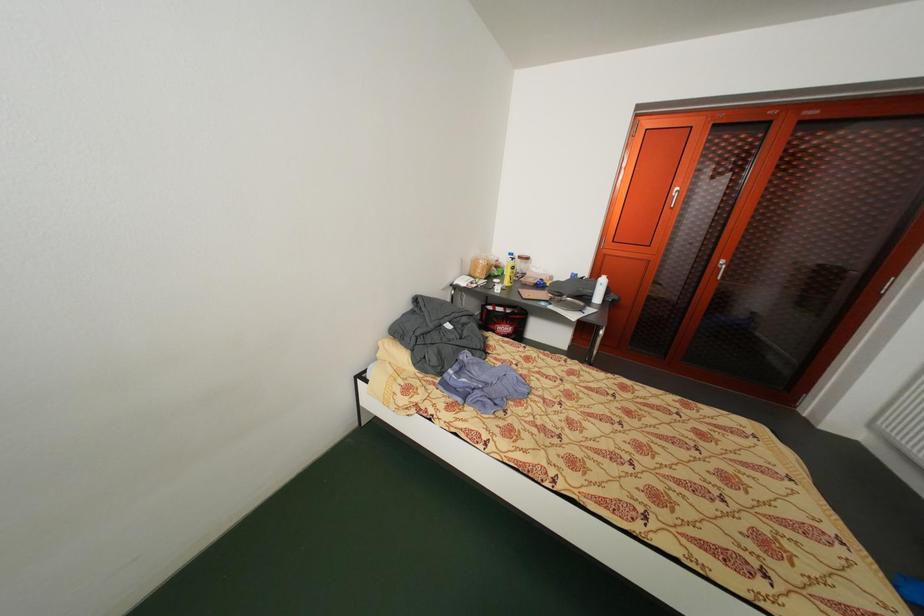
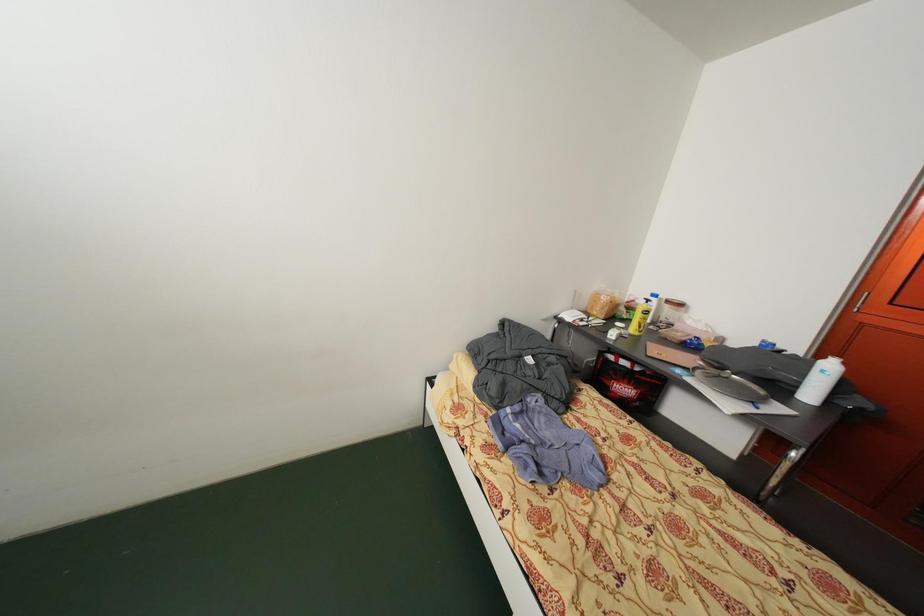
Question: How did the camera likely rotate?

Choices:
 (A) Left
 (B) Right
 (C) Up
 (D) Down

Answer: (A)